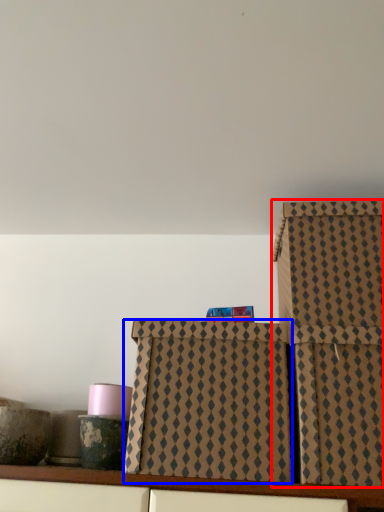
Question: Which of the following is the farthest to the observer, box (highlighted by a red box) or box (highlighted by a blue box)?

Choices:
 (A) box
 (B) box

Answer: (B)